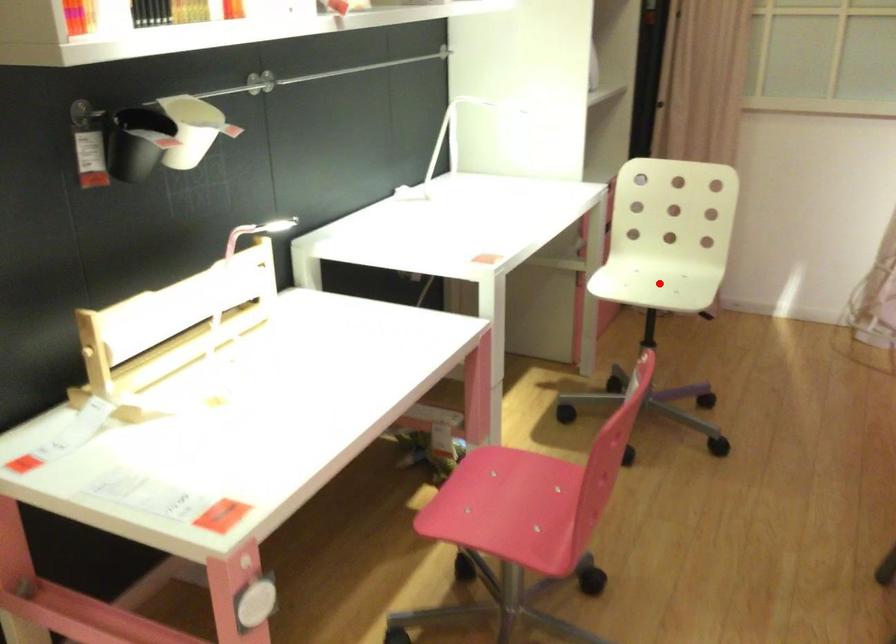
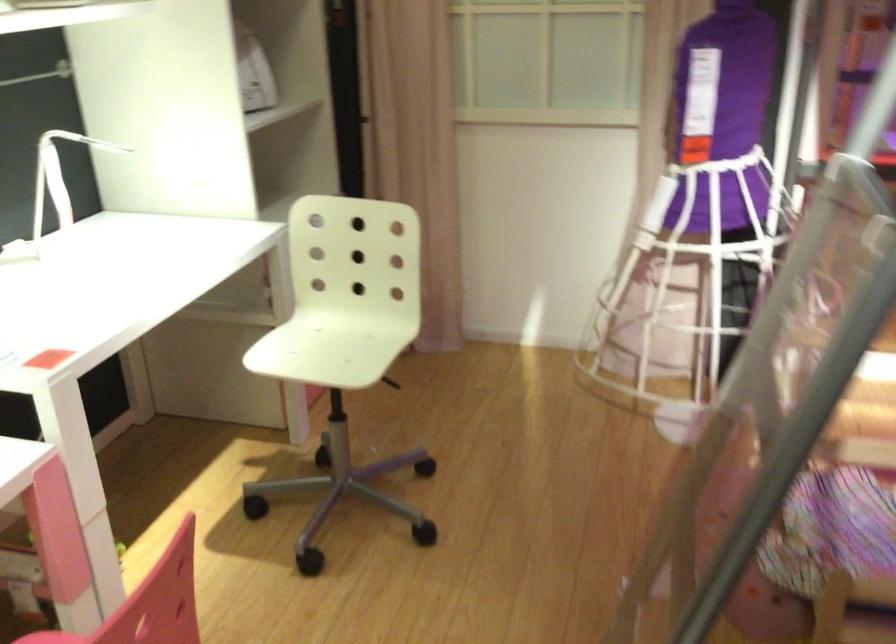
Where in the second image is the point corresponding to the highlighted location from the first image?

(331, 345)